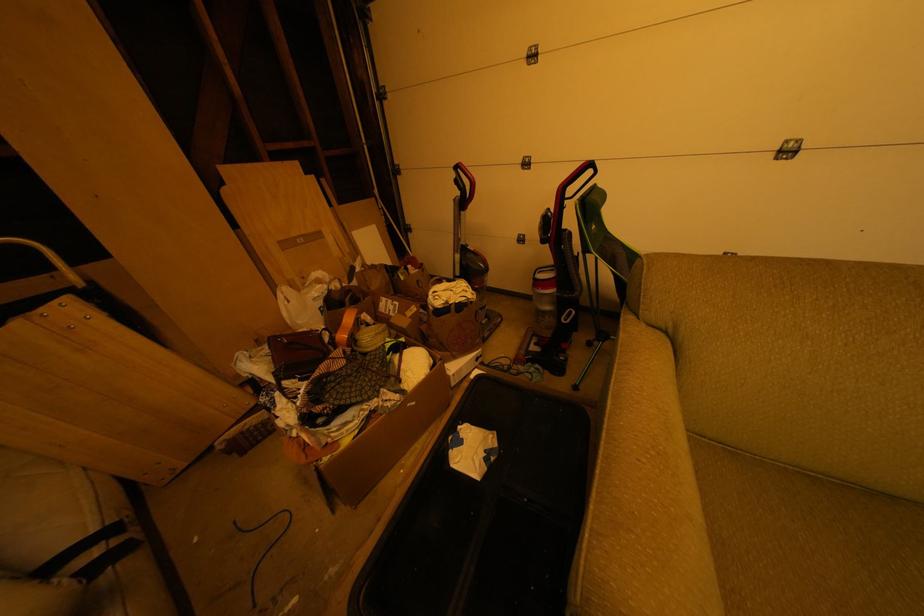
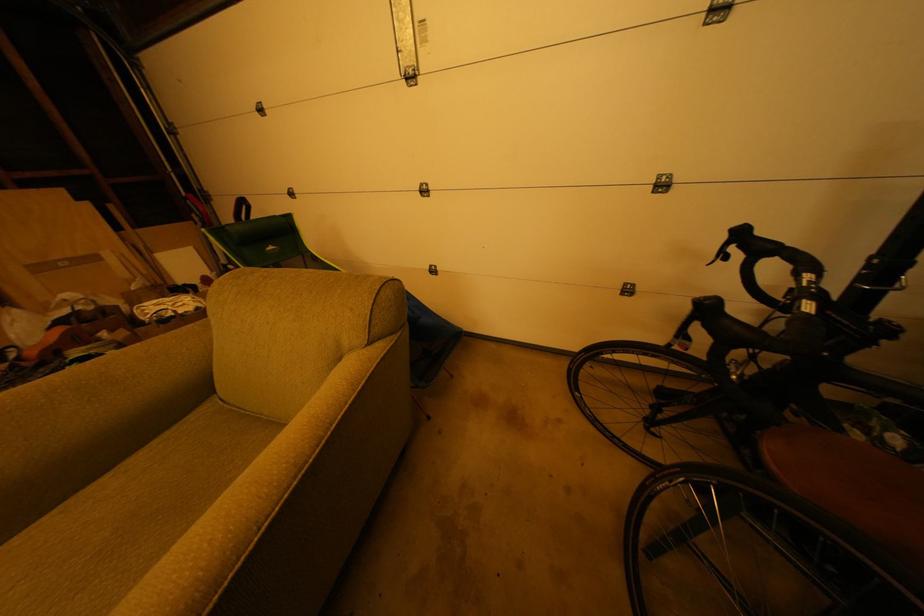
Question: What movement of the cameraman would produce the second image?

Choices:
 (A) Left
 (B) Right
 (C) Forward
 (D) Backward

Answer: (B)